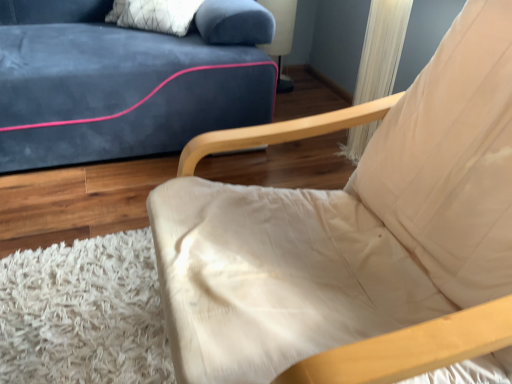
Question: Are matte plastic table lamp at upper center and beige fabric chair at center far apart?

Choices:
 (A) no
 (B) yes

Answer: (B)

Question: Considering the relative positions of matte plastic table lamp at upper center and beige fabric chair at center in the image provided, is matte plastic table lamp at upper center to the right of beige fabric chair at center from the viewer's perspective?

Choices:
 (A) no
 (B) yes

Answer: (A)

Question: From a real-world perspective, does matte plastic table lamp at upper center sit lower than beige fabric chair at center?

Choices:
 (A) no
 (B) yes

Answer: (B)

Question: Does matte plastic table lamp at upper center have a lesser width compared to beige fabric chair at center?

Choices:
 (A) no
 (B) yes

Answer: (B)

Question: Is matte plastic table lamp at upper center beside beige fabric chair at center?

Choices:
 (A) yes
 (B) no

Answer: (B)

Question: From a real-world perspective, is matte plastic table lamp at upper center on top of beige fabric chair at center?

Choices:
 (A) yes
 (B) no

Answer: (B)

Question: From a real-world perspective, is beige fabric chair at center over matte plastic table lamp at upper center?

Choices:
 (A) yes
 (B) no

Answer: (A)

Question: Is beige fabric chair at center looking in the opposite direction of matte plastic table lamp at upper center?

Choices:
 (A) no
 (B) yes

Answer: (A)

Question: Is beige fabric chair at center at the right side of matte plastic table lamp at upper center?

Choices:
 (A) no
 (B) yes

Answer: (B)

Question: Could you tell me if beige fabric chair at center is turned towards matte plastic table lamp at upper center?

Choices:
 (A) yes
 (B) no

Answer: (B)

Question: Is beige fabric chair at center wider than matte plastic table lamp at upper center?

Choices:
 (A) yes
 (B) no

Answer: (A)

Question: Is beige fabric chair at center positioned beyond the bounds of matte plastic table lamp at upper center?

Choices:
 (A) yes
 (B) no

Answer: (A)

Question: From their relative heights in the image, would you say beige fabric chair at center is taller or shorter than matte plastic table lamp at upper center?

Choices:
 (A) tall
 (B) short

Answer: (A)